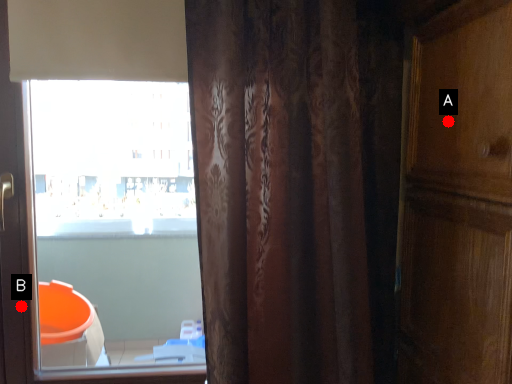
Question: Two points are circled on the image, labeled by A and B beside each circle. Among these points, which one is nearest to the camera?

Choices:
 (A) A is closer
 (B) B is closer

Answer: (A)